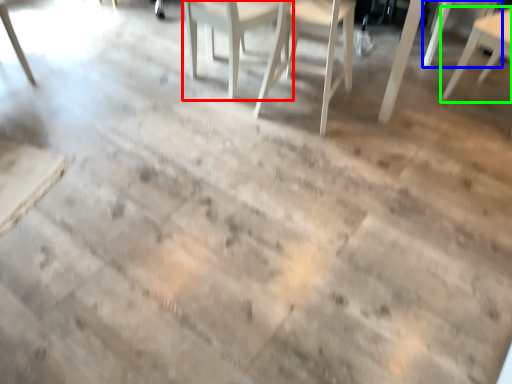
Question: Based on their relative distances, which object is nearer to chair (highlighted by a red box)? Choose from chair (highlighted by a blue box) and chair (highlighted by a green box).

Choices:
 (A) chair
 (B) chair

Answer: (B)